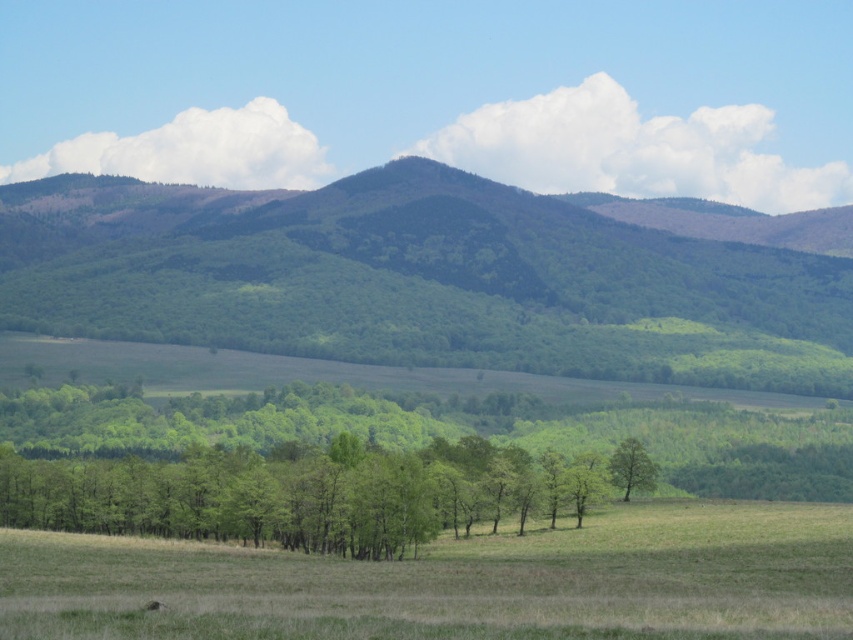
Question: Does green forested hill at center appear on the right side of green matte tree at center?

Choices:
 (A) no
 (B) yes

Answer: (A)

Question: Observing the image, what is the correct spatial positioning of green forested hill at center in reference to green matte tree at center?

Choices:
 (A) left
 (B) right

Answer: (A)

Question: Does green forested hill at center lie behind green matte tree at center?

Choices:
 (A) no
 (B) yes

Answer: (B)

Question: Which point is farther to the camera?

Choices:
 (A) (614, 476)
 (B) (311, 209)

Answer: (B)

Question: Among these points, which one is nearest to the camera?

Choices:
 (A) (642, 449)
 (B) (569, 240)

Answer: (A)

Question: Which point is farther from the camera taking this photo?

Choices:
 (A) (212, 280)
 (B) (624, 451)

Answer: (A)